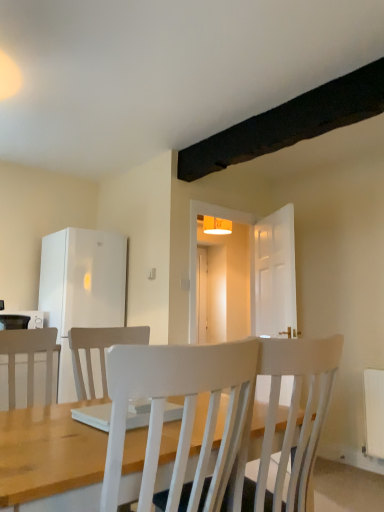
Question: Considering the relative sizes of white glossy microwave at left and white textured chair at center in the image provided, is white glossy microwave at left taller than white textured chair at center?

Choices:
 (A) yes
 (B) no

Answer: (B)

Question: Can you see white glossy microwave at left touching white textured chair at center?

Choices:
 (A) yes
 (B) no

Answer: (B)

Question: From a real-world perspective, is white glossy microwave at left positioned under white textured chair at center based on gravity?

Choices:
 (A) yes
 (B) no

Answer: (B)

Question: Is white glossy microwave at left to the left of white textured chair at center from the viewer's perspective?

Choices:
 (A) no
 (B) yes

Answer: (B)

Question: Is white glossy microwave at left positioned with its back to white textured chair at center?

Choices:
 (A) no
 (B) yes

Answer: (A)

Question: Is white glossy microwave at left shorter than white textured chair at center?

Choices:
 (A) yes
 (B) no

Answer: (A)

Question: Is white matte refrigerator at left behind white glossy microwave at left?

Choices:
 (A) yes
 (B) no

Answer: (A)

Question: From the image's perspective, is white matte refrigerator at left below white glossy microwave at left?

Choices:
 (A) no
 (B) yes

Answer: (A)

Question: Can you confirm if white matte refrigerator at left is smaller than white glossy microwave at left?

Choices:
 (A) no
 (B) yes

Answer: (A)

Question: From the image's perspective, is white matte refrigerator at left on white glossy microwave at left?

Choices:
 (A) yes
 (B) no

Answer: (A)

Question: Is white glossy microwave at left completely or partially inside white matte refrigerator at left?

Choices:
 (A) yes
 (B) no

Answer: (B)

Question: Is white matte refrigerator at left wider than white glossy microwave at left?

Choices:
 (A) yes
 (B) no

Answer: (A)

Question: Is white glossy microwave at left not within white matte refrigerator at left?

Choices:
 (A) no
 (B) yes

Answer: (B)